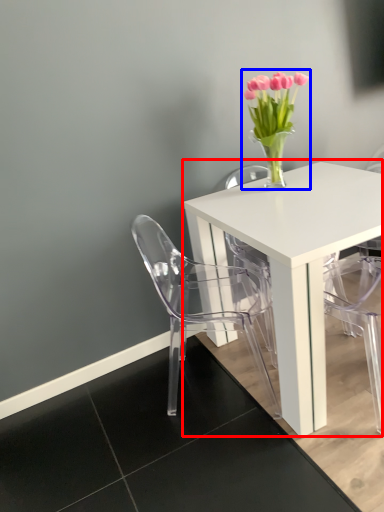
Question: Which object is further to the camera taking this photo, table (highlighted by a red box) or floral arrangement (highlighted by a blue box)?

Choices:
 (A) table
 (B) floral arrangement

Answer: (B)